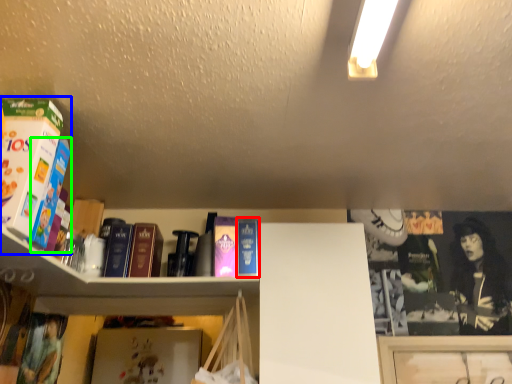
Question: Estimate the real-world distances between objects in this image. Which object is farther from paperback book (highlighted by a red box), book (highlighted by a blue box) or book (highlighted by a green box)?

Choices:
 (A) book
 (B) book

Answer: (A)